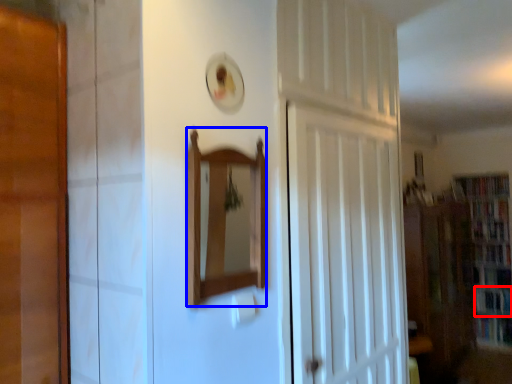
Question: Among these objects, which one is farthest to the camera, book (highlighted by a red box) or mirror (highlighted by a blue box)?

Choices:
 (A) book
 (B) mirror

Answer: (A)